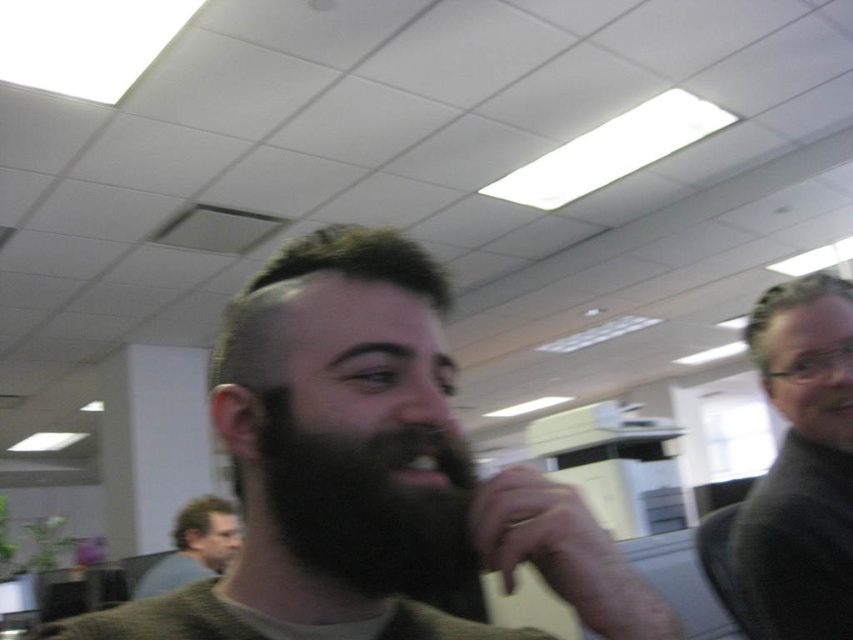
Question: Is dark gray sweater at right below dark brown thick beard at center?

Choices:
 (A) yes
 (B) no

Answer: (A)

Question: In this image, where is dark brown beard at center located relative to dark gray sweater at right?

Choices:
 (A) below
 (B) above

Answer: (B)

Question: Does dark gray sweater at right have a lesser width compared to dark brown hair at lower left?

Choices:
 (A) no
 (B) yes

Answer: (B)

Question: Which of the following is the closest to the observer?

Choices:
 (A) (221, 513)
 (B) (845, 312)
 (C) (834, 291)

Answer: (B)

Question: Estimate the real-world distances between objects in this image. Which object is farther from the gray matte hair at upper right?

Choices:
 (A) dark brown thick beard at center
 (B) dark brown beard at center
 (C) dark gray sweater at right
 (D) short dark hair at center

Answer: (D)

Question: Among these objects, which one is nearest to the camera?

Choices:
 (A) dark gray sweater at right
 (B) gray matte hair at upper right

Answer: (A)